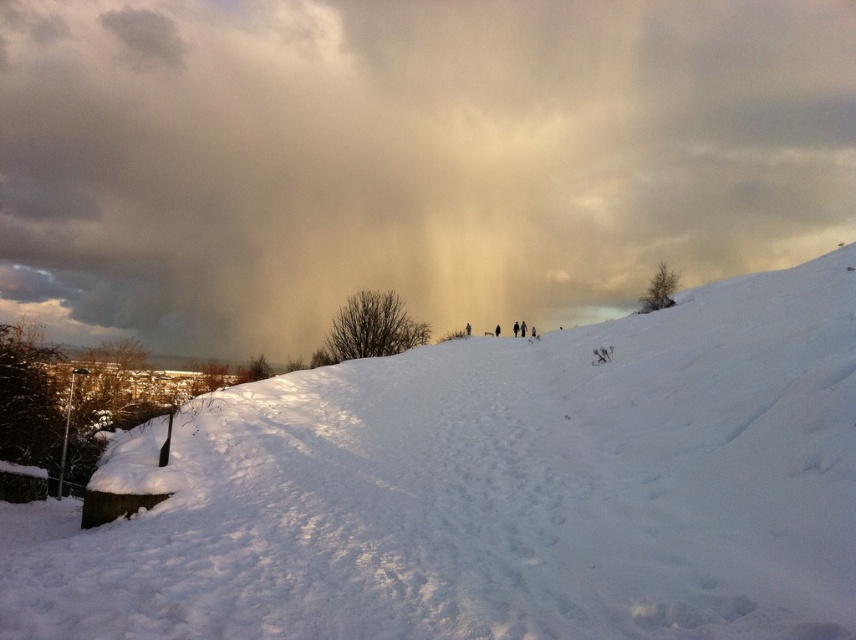
Question: Can you confirm if cloudy sky at upper center is bigger than white fluffy snow at center?

Choices:
 (A) no
 (B) yes

Answer: (B)

Question: Which point is closer to the camera taking this photo?

Choices:
 (A) (767, 193)
 (B) (314, 476)

Answer: (B)

Question: Is cloudy sky at upper center smaller than white fluffy snow at center?

Choices:
 (A) yes
 (B) no

Answer: (B)

Question: Which of the following is the closest to the observer?

Choices:
 (A) (331, 436)
 (B) (88, 74)

Answer: (A)

Question: Does cloudy sky at upper center come behind white fluffy snow at center?

Choices:
 (A) no
 (B) yes

Answer: (B)

Question: Which object is closer to the camera taking this photo?

Choices:
 (A) cloudy sky at upper center
 (B) white fluffy snow at center

Answer: (B)